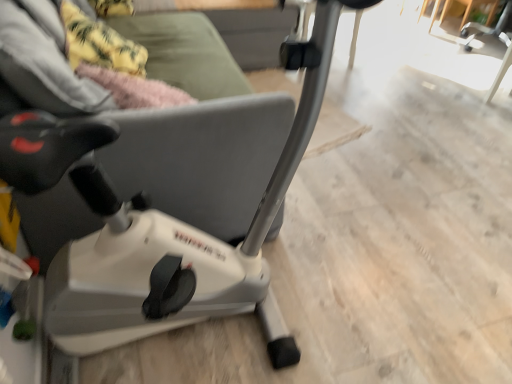
Measure the distance between point (73,354) and camera.

4.43 feet.

Describe the element at coordinates (157, 228) in the screenshot. This screenshot has height=384, width=512. I see `white plastic stationary bicycle at center` at that location.

This screenshot has width=512, height=384. Find the location of `white plastic stationary bicycle at center`. white plastic stationary bicycle at center is located at coordinates (157, 228).

Where is `white plastic stationary bicycle at center`? white plastic stationary bicycle at center is located at coordinates (157, 228).